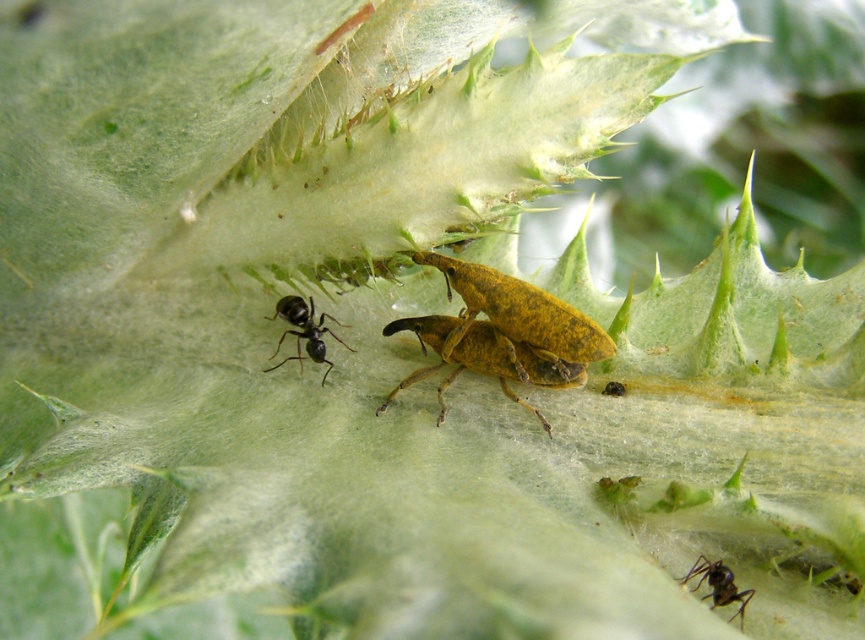
You are standing in front of the plant and want to reach the point at coordinates point (334,317). If your hand can extend 4 feet, will you be able to reach it?

The point (334,317) is 3.96 feet away from the camera, so yes, your hand can reach it since it extends 4 feet.